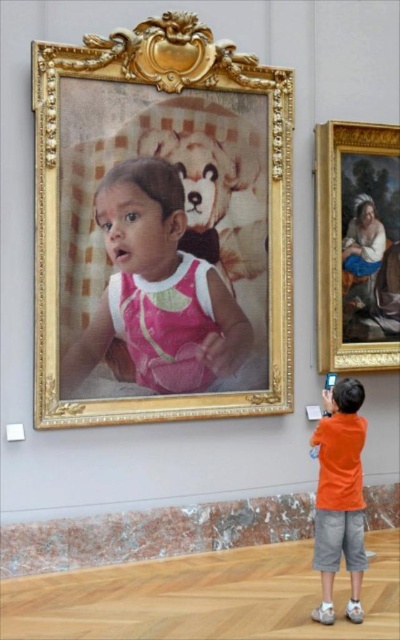
Does gold ornate frame at upper center have a greater height compared to orange cotton shirt at lower right?

Yes.

Can you confirm if gold ornate frame at upper center is wider than orange cotton shirt at lower right?

Yes, gold ornate frame at upper center is wider than orange cotton shirt at lower right.

Identify the location of gold ornate frame at upper center. The height and width of the screenshot is (640, 400). (161, 228).

The image size is (400, 640). Describe the element at coordinates (158, 291) in the screenshot. I see `matte pink dress at center` at that location.

Does point (109, 304) lie behind point (354, 212)?

No, (109, 304) is closer to viewer.

At what (x,y) coordinates should I click in order to perform the action: click on matte pink dress at center. Please return your answer as a coordinate pair (x, y). The height and width of the screenshot is (640, 400). Looking at the image, I should click on (158, 291).

Image resolution: width=400 pixels, height=640 pixels. What are the coordinates of `matte pink dress at center` in the screenshot? It's located at (158, 291).

Based on the photo, can you confirm if matte pink dress at center is shorter than orange cotton shirt at lower right?

No, matte pink dress at center is not shorter than orange cotton shirt at lower right.

Does matte pink dress at center have a greater height compared to orange cotton shirt at lower right?

Indeed, matte pink dress at center has a greater height compared to orange cotton shirt at lower right.

Which is behind, point (206, 284) or point (356, 512)?

The point (206, 284) is behind.

Find the location of a particular element. matte pink dress at center is located at coordinates (158, 291).